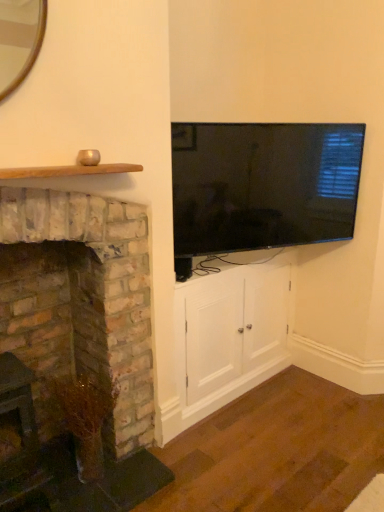
Question: Based on their positions, is flat-screen tv at upper right located to the left or right of brick fireplace at left?

Choices:
 (A) left
 (B) right

Answer: (B)

Question: From a real-world perspective, is flat-screen tv at upper right above or below brick fireplace at left?

Choices:
 (A) below
 (B) above

Answer: (B)

Question: Based on their relative distances, which object is farther from the flat-screen tv at upper right?

Choices:
 (A) brick fireplace at left
 (B) white wood cabinet at center

Answer: (A)

Question: Based on their relative distances, which object is nearer to the flat-screen tv at upper right?

Choices:
 (A) brick fireplace at left
 (B) white wood cabinet at center

Answer: (B)